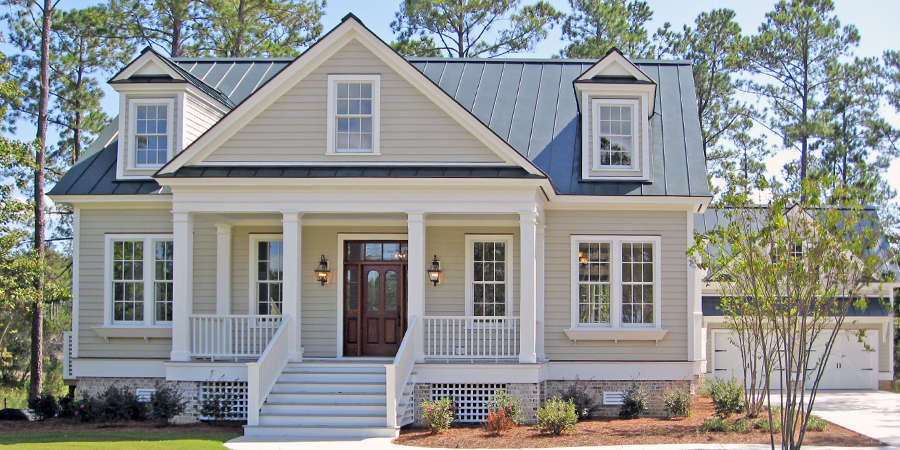
The width and height of the screenshot is (900, 450). In order to click on windows in this screenshot , I will do `click(148, 124)`, `click(129, 300)`, `click(164, 304)`, `click(252, 262)`, `click(364, 112)`, `click(482, 276)`, `click(590, 273)`, `click(644, 252)`, `click(622, 132)`, `click(796, 249)`.